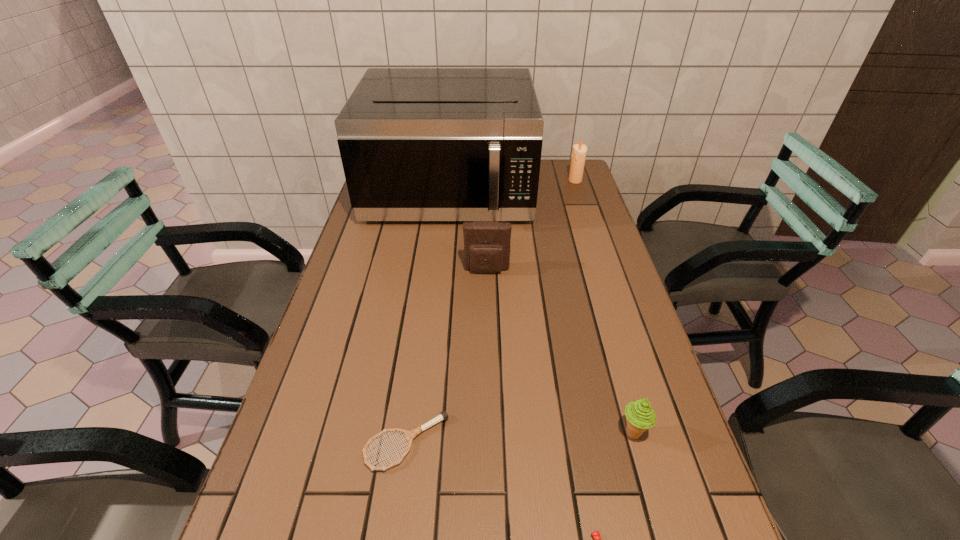
Find the location of a particular element. The image size is (960, 540). vacant position in the image that satisfies the following two spatial constraints: 1. on the back side of the candle; 2. on the right side of the icecream is located at coordinates (562, 180).

Locate an element on the screen. This screenshot has height=540, width=960. free space that satisfies the following two spatial constraints: 1. on the front-facing side of the fourth tallest object; 2. on the left side of the microwave_oven is located at coordinates click(424, 433).